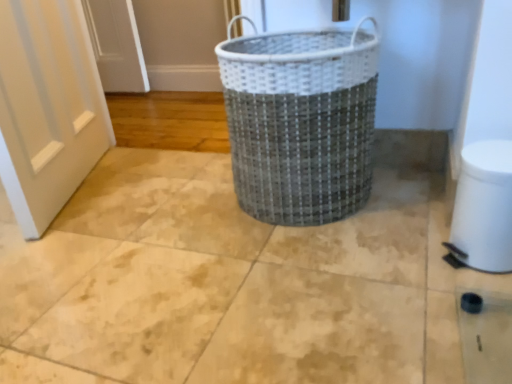
I want to click on vacant space that is to the left of metallic woven basket at center, so click(173, 212).